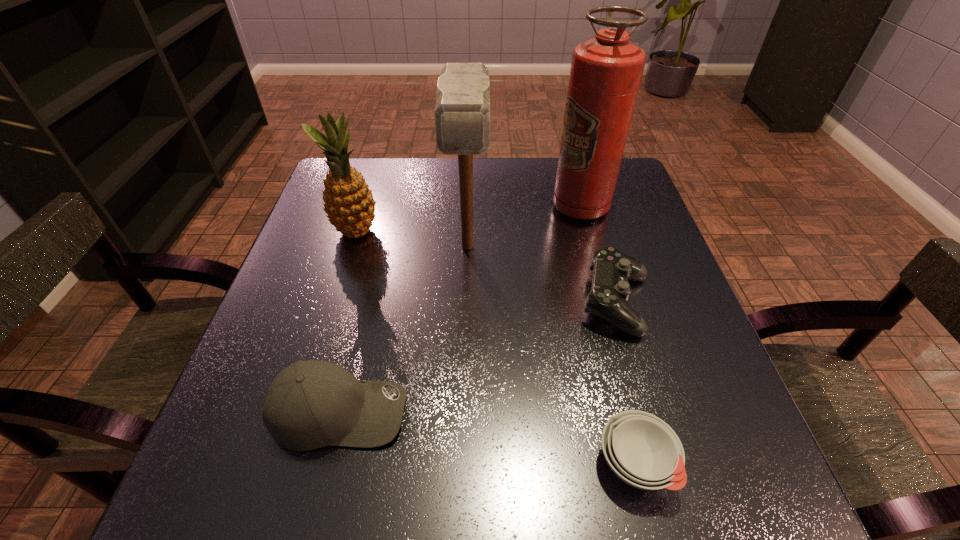
Identify the location of vacant space located on the striking face of the third object from left to right. The width and height of the screenshot is (960, 540). (463, 421).

Find the location of a particular element. This screenshot has width=960, height=540. vacant space located on the front of the pineapple is located at coordinates (338, 290).

Where is `free spot located 0.120m on the front brim of the third shortest object`? The width and height of the screenshot is (960, 540). free spot located 0.120m on the front brim of the third shortest object is located at coordinates (481, 411).

Locate an element on the screen. This screenshot has width=960, height=540. free space located 0.190m on the left of the second shortest object is located at coordinates (483, 303).

What are the coordinates of `free region located on the back of the soup bowl` in the screenshot? It's located at coord(602,331).

You are a GUI agent. You are given a task and a screenshot of the screen. Output one action in this format:
    pyautogui.click(x=<x>, y=<y>)
    Task: Click on the object present at the far edge
    
    Given the screenshot: What is the action you would take?
    pyautogui.click(x=606, y=72)

Locate an element on the screen. object that is at the near edge is located at coordinates (642, 450).

This screenshot has width=960, height=540. In order to click on pineapple that is positioned at the left edge in this screenshot , I will do `click(349, 203)`.

This screenshot has width=960, height=540. In order to click on baseball cap situated at the left edge in this screenshot , I will do `click(311, 404)`.

This screenshot has width=960, height=540. In order to click on fire extinguisher at the right edge in this screenshot , I will do `click(606, 72)`.